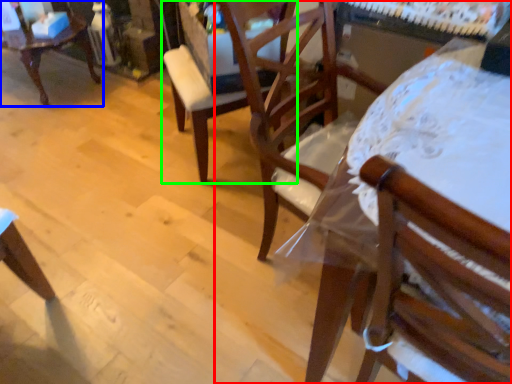
Question: Estimate the real-world distances between objects in this image. Which object is closer to chair (highlighted by a red box), chair (highlighted by a blue box) or chair (highlighted by a green box)?

Choices:
 (A) chair
 (B) chair

Answer: (B)